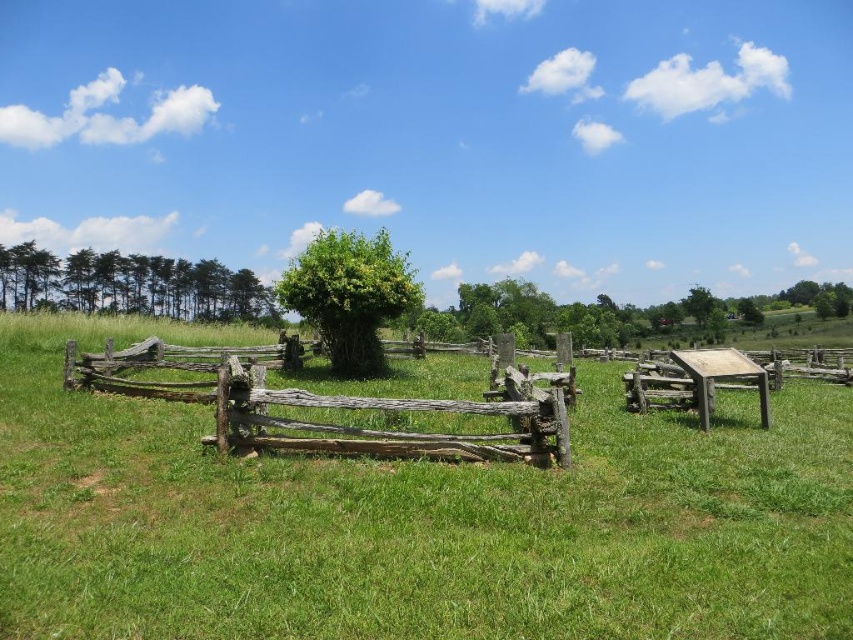
Does weathered wood fence at center have a greater width compared to green leafy tree at center?

Correct, the width of weathered wood fence at center exceeds that of green leafy tree at center.

Can you confirm if weathered wood fence at center is positioned above green leafy tree at center?

Incorrect, weathered wood fence at center is not positioned above green leafy tree at center.

Does point (367, 432) lie behind point (314, 241)?

No, (367, 432) is closer to viewer.

Find the location of a particular element. Image resolution: width=853 pixels, height=640 pixels. weathered wood fence at center is located at coordinates (328, 404).

Is green matte trees at left to the right of green leafy tree at center from the viewer's perspective?

Incorrect, green matte trees at left is not on the right side of green leafy tree at center.

The height and width of the screenshot is (640, 853). Identify the location of green matte trees at left. (131, 285).

This screenshot has width=853, height=640. Find the location of `green matte trees at left`. green matte trees at left is located at coordinates (131, 285).

Consider the image. Between weathered wood fence at center and green matte trees at left, which one appears on the left side from the viewer's perspective?

green matte trees at left is more to the left.

Who is more forward, (256, 390) or (126, 276)?

Point (256, 390)

This screenshot has height=640, width=853. What do you see at coordinates (328, 404) in the screenshot?
I see `weathered wood fence at center` at bounding box center [328, 404].

Locate an element on the screen. weathered wood fence at center is located at coordinates (x=328, y=404).